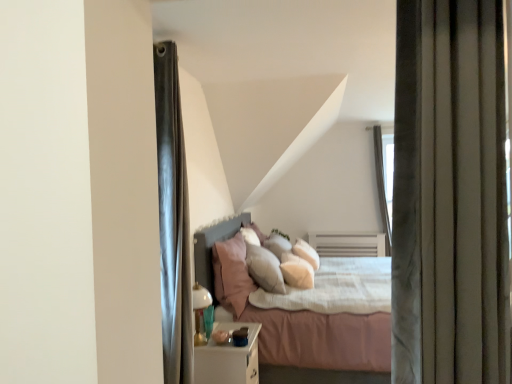
Question: Is soft white pillow at center, the first pillow positioned from the right, taller or shorter than soft pink fabric bed at center?

Choices:
 (A) tall
 (B) short

Answer: (B)

Question: From a real-world perspective, is soft white pillow at center, arranged as the 2th pillow when viewed from the left, above or below soft pink fabric bed at center?

Choices:
 (A) above
 (B) below

Answer: (A)

Question: Estimate the real-world distances between objects in this image. Which object is farther from the white glossy nightstand at lower center?

Choices:
 (A) white glossy lamp at lower left
 (B) soft pink fabric bed at center
 (C) soft white pillow at center, arranged as the 2th pillow when viewed from the left
 (D) pink fabric pillow at center, the 2th pillow when ordered from right to left
 (E) velvet gray curtain at right

Answer: (E)

Question: Estimate the real-world distances between objects in this image. Which object is closer to the velvet gray curtain at right?

Choices:
 (A) soft pink fabric bed at center
 (B) soft white pillow at center, arranged as the 2th pillow when viewed from the left
 (C) white glossy lamp at lower left
 (D) white glossy nightstand at lower center
 (E) pink fabric pillow at center, the 2th pillow when ordered from right to left

Answer: (D)